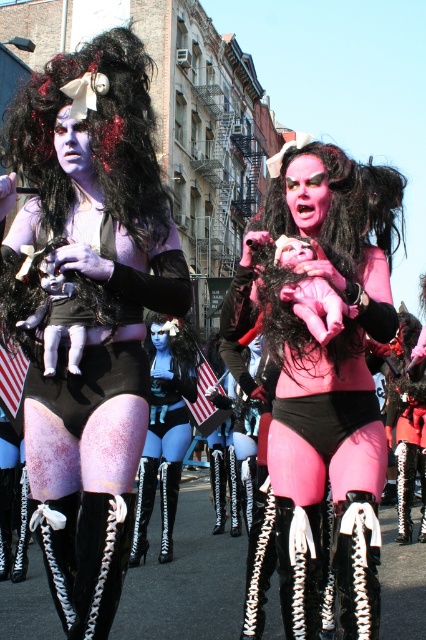
Question: Which is farther from the pink matte wig at center?

Choices:
 (A) matte black doll at center
 (B) pink matte/black leather doll at center
 (C) purple matte wig at upper left
 (D) matte black wig at center

Answer: (D)

Question: Does matte black wig at center come behind pink matte wig at center?

Choices:
 (A) no
 (B) yes

Answer: (B)

Question: Is matte black doll at center thinner than pink matte/black leather doll at center?

Choices:
 (A) no
 (B) yes

Answer: (B)

Question: Which object appears closest to the camera in this image?

Choices:
 (A) matte black doll at center
 (B) pink matte wig at center

Answer: (A)

Question: Among these points, which one is nearest to the camera?

Choices:
 (A) (112, 65)
 (B) (328, 273)
 (C) (261, 212)
 (D) (190, 344)

Answer: (B)

Question: From the image, what is the correct spatial relationship of pink matte/black leather doll at center in relation to purple matte wig at upper left?

Choices:
 (A) below
 (B) above

Answer: (A)